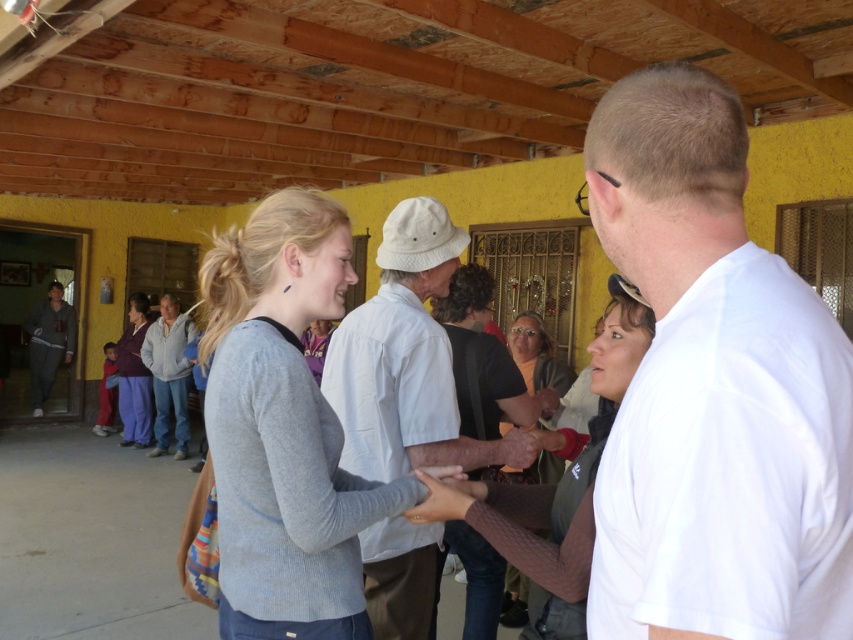
You are a photographer setting up a shoot in the room described. You need to position a backdrop that is 1.5 meters tall. Given the height of the gray sweater at center and gray sweatpants at left, will the backdrop be taller than both objects?

The gray sweater at center is not as tall as gray sweatpants at left, but the height of the sweatpants is not provided. Without knowing the exact height of either object, it is impossible to determine if the backdrop will be taller than both.

You are organizing a clothing display and need to arrange the matte orange sweater at center and the light gray sweater at left based on their heights. Which sweater should you place on the lower shelf to ensure proper visibility?

The matte orange sweater at center is shorter than the light gray sweater at left, so place the matte orange sweater at center on the lower shelf to ensure proper visibility.

You are standing at the camera position and want to reach the point marked as point (x=816, y=525). If your walking speed is 3 feet per second, how many seconds will it take you to reach that point?

The distance between the point (x=816, y=525) and the camera is 26.85 inches. Converting inches to feet, 26.85 inches is approximately 2.2375 feet. At a speed of 3 feet per second, the time required would be distance divided by speed, so 2.2375 divided by 3 equals approximately 0.746 seconds. Therefore, it will take roughly 0.75 seconds to reach the point.